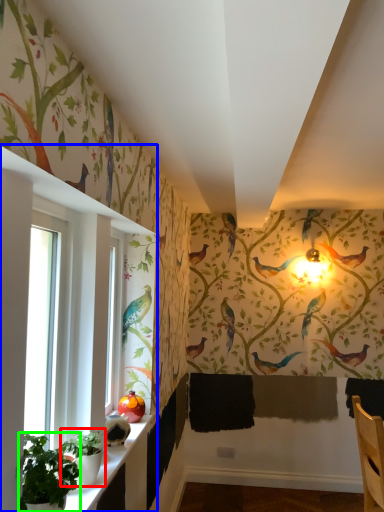
Question: Which is nearer to the plant (highlighted by a red box)? window (highlighted by a blue box) or plant (highlighted by a green box).

Choices:
 (A) window
 (B) plant

Answer: (B)